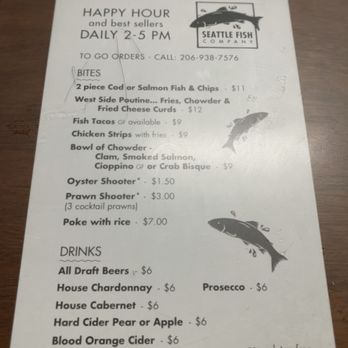
Where is `black wood table, background`? This screenshot has width=348, height=348. black wood table, background is located at coordinates (318, 93).